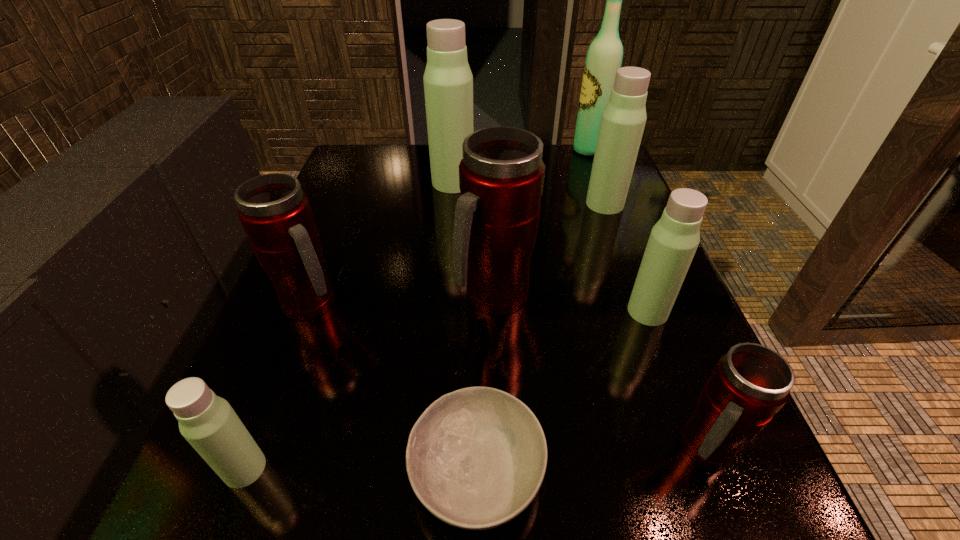
Locate an element on the screen. This screenshot has height=540, width=960. the smallest red thermos bottle is located at coordinates (751, 383).

Identify the location of the leftmost light thermos bottle. (208, 422).

I want to click on the smallest light thermos bottle, so click(208, 422).

The width and height of the screenshot is (960, 540). In order to click on vacant area located 0.130m on the front-facing side of the farthest object in this screenshot , I will do `click(526, 150)`.

I want to click on vacant space situated on the front-facing side of the farthest object, so click(x=447, y=150).

Where is `free location located 0.080m on the front-facing side of the farthest object`? This screenshot has width=960, height=540. free location located 0.080m on the front-facing side of the farthest object is located at coordinates (543, 150).

Locate an element on the screen. free space located 0.280m on the right of the farthest thermos bottle is located at coordinates (586, 183).

Locate an element on the screen. The height and width of the screenshot is (540, 960). free space located 0.210m on the back of the third smallest light thermos bottle is located at coordinates (586, 153).

Where is `vacant area located 0.110m on the side with the handle of the biggest red thermos bottle`? The image size is (960, 540). vacant area located 0.110m on the side with the handle of the biggest red thermos bottle is located at coordinates (497, 380).

This screenshot has height=540, width=960. What are the coordinates of `free space located 0.120m on the side with the handle of the leftmost red thermos bottle` in the screenshot? It's located at (410, 303).